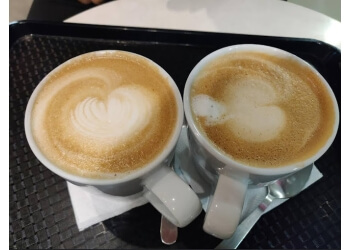
At what (x,y) coordinates should I click in order to perform the action: click on spoon. Please return your answer as a coordinate pair (x, y). This screenshot has height=250, width=350. Looking at the image, I should click on (283, 187).